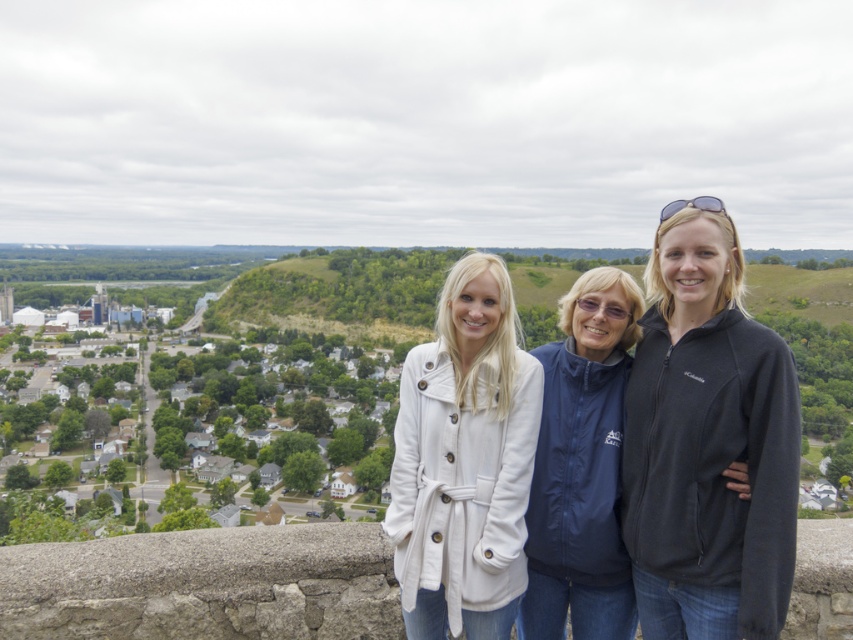
Question: Which point is farther to the camera?

Choices:
 (A) white fleece coat at center
 (B) black fleece jacket at center

Answer: (A)

Question: Is the position of white fleece jacket at center more distant than that of white fleece coat at center?

Choices:
 (A) no
 (B) yes

Answer: (A)

Question: Can you confirm if white fleece jacket at center is positioned to the left of white fleece coat at center?

Choices:
 (A) no
 (B) yes

Answer: (A)

Question: Estimate the real-world distances between objects in this image. Which object is closer to the white fleece jacket at center?

Choices:
 (A) black fleece jacket at center
 (B) white fleece coat at center

Answer: (A)

Question: Can you confirm if white fleece jacket at center is wider than black fleece jacket at center?

Choices:
 (A) yes
 (B) no

Answer: (A)

Question: Among these points, which one is farthest from the camera?

Choices:
 (A) (682, 417)
 (B) (410, 612)
 (C) (685, 380)

Answer: (C)